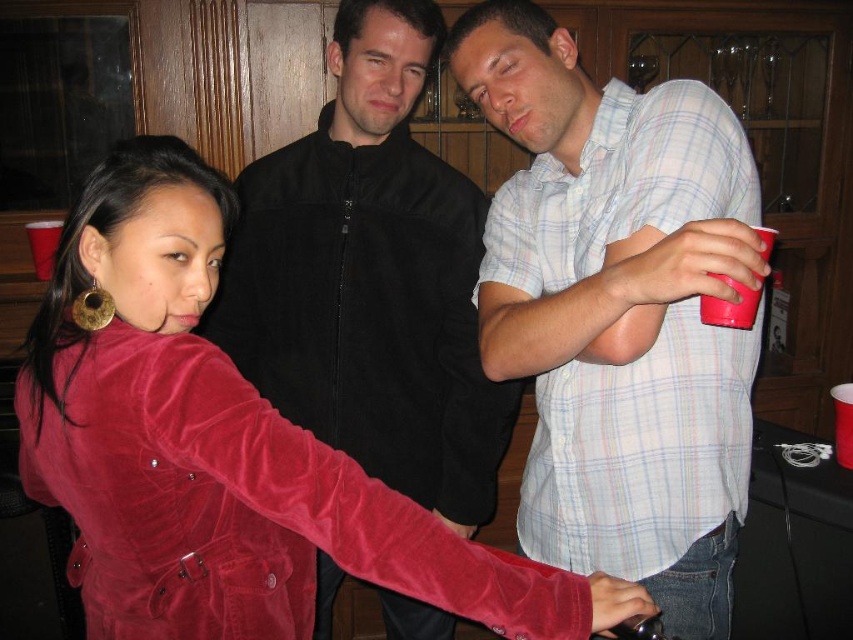
Question: Which object is positioned farthest from the velvet jacket at center?

Choices:
 (A) light blue plaid shirt at center
 (B) velvet red jacket at center

Answer: (B)

Question: Can you confirm if light blue plaid shirt at center is positioned to the right of velvet jacket at center?

Choices:
 (A) yes
 (B) no

Answer: (A)

Question: Can you confirm if velvet red jacket at center is positioned below velvet jacket at center?

Choices:
 (A) yes
 (B) no

Answer: (A)

Question: Which point appears farthest from the camera in this image?

Choices:
 (A) (187, 433)
 (B) (566, 109)

Answer: (B)

Question: Which object appears closest to the camera in this image?

Choices:
 (A) velvet red jacket at center
 (B) light blue plaid shirt at center
 (C) velvet jacket at center

Answer: (A)

Question: Does light blue plaid shirt at center have a smaller size compared to matte plastic cup at right?

Choices:
 (A) yes
 (B) no

Answer: (B)